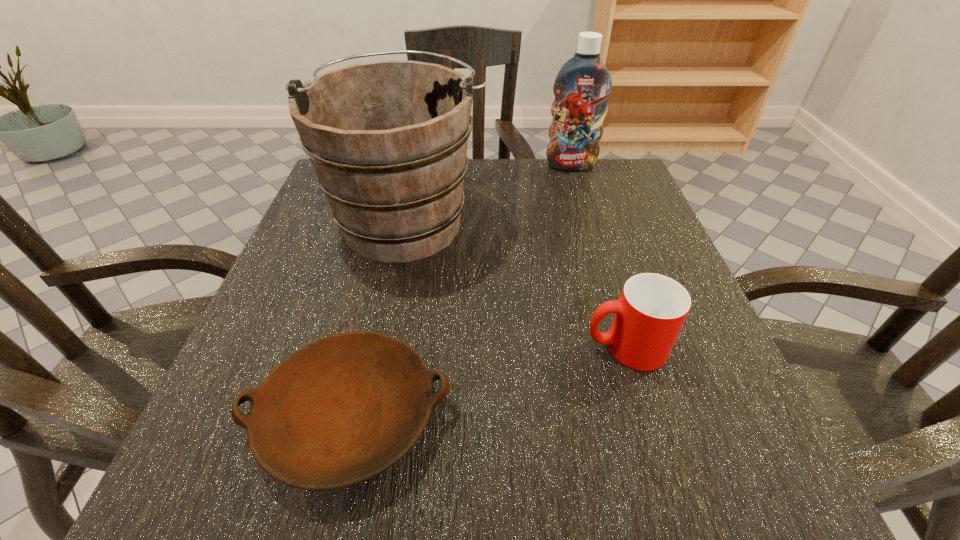
I want to click on vacant space at the left edge of the desktop, so click(x=325, y=276).

Image resolution: width=960 pixels, height=540 pixels. I want to click on free space at the right edge, so click(661, 264).

This screenshot has height=540, width=960. I want to click on vacant space at the far right corner, so click(578, 179).

In order to click on free area in between the shortest object and the shampoo in this screenshot , I will do `click(461, 292)`.

At what (x,y) coordinates should I click in order to perform the action: click on blank region between the second shortest object and the shortest object. Please return your answer as a coordinate pair (x, y). The image size is (960, 540). Looking at the image, I should click on (488, 382).

Locate an element on the screen. The width and height of the screenshot is (960, 540). empty location between the cup and the third nearest object is located at coordinates (516, 284).

Find the location of a particular element. This screenshot has height=540, width=960. free spot between the plate and the second farthest object is located at coordinates point(378,319).

The image size is (960, 540). I want to click on vacant space that is in between the second farthest object and the farthest object, so click(489, 193).

The image size is (960, 540). Identify the location of vacant space that is in between the shortest object and the bucket. (378, 319).

The height and width of the screenshot is (540, 960). What are the coordinates of `free space between the shortest object and the cup` in the screenshot? It's located at (488, 382).